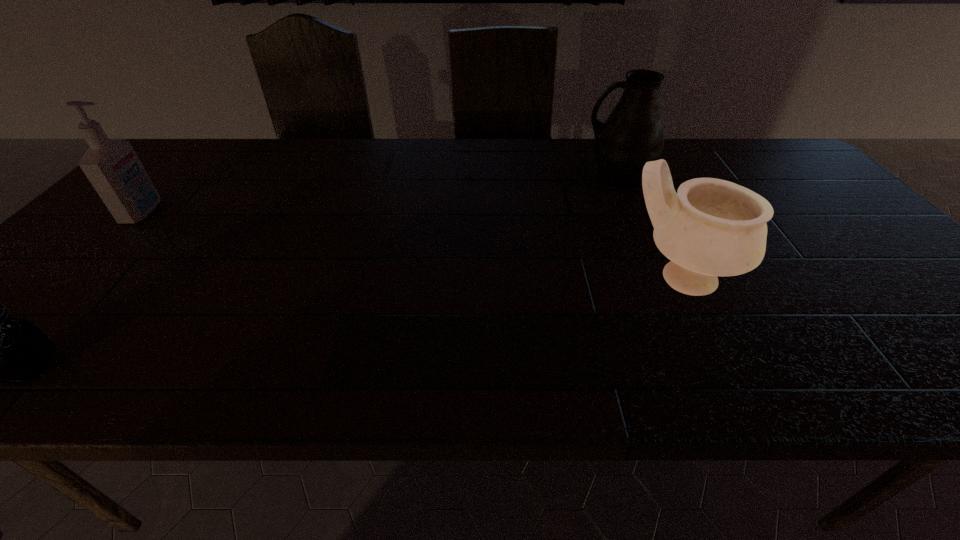
Identify the location of the third nearest object. (113, 168).

Locate an element on the screen. the farthest object is located at coordinates (633, 134).

You are a GUI agent. You are given a task and a screenshot of the screen. Output one action in this format:
    pyautogui.click(x=<x>, y=<y>)
    Task: Click on the third farthest object
    This screenshot has height=540, width=960.
    Given the screenshot: What is the action you would take?
    pyautogui.click(x=711, y=227)

Find the location of a particular element. The image size is (960, 540). pottery is located at coordinates (711, 227).

Where is `vacant area located on the front label of the second farthest object`? Image resolution: width=960 pixels, height=540 pixels. vacant area located on the front label of the second farthest object is located at coordinates (284, 213).

Where is `vacant space located on the handle side of the farthest object`? This screenshot has height=540, width=960. vacant space located on the handle side of the farthest object is located at coordinates (541, 179).

You are a GUI agent. You are given a task and a screenshot of the screen. Output one action in this format:
    pyautogui.click(x=<x>, y=<y>)
    Task: Click on the vacant space located 0.090m on the handle side of the farthest object
    This screenshot has height=540, width=960.
    Given the screenshot: What is the action you would take?
    pyautogui.click(x=551, y=179)

At what (x,y) coordinates should I click in order to perform the action: click on vacant space located 0.130m on the handle side of the farthest object. Please return your answer as a coordinate pair (x, y). Image resolution: width=960 pixels, height=540 pixels. Looking at the image, I should click on (538, 179).

Identify the location of free space located 0.180m on the left of the second nearest object. This screenshot has height=540, width=960. (543, 278).

Where is `object at the far edge`? The height and width of the screenshot is (540, 960). object at the far edge is located at coordinates (633, 134).